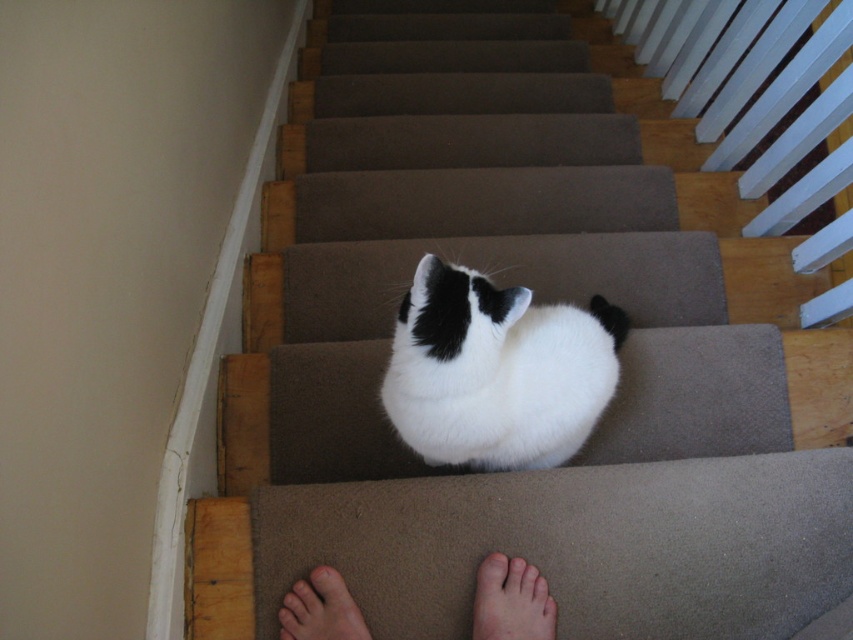
You are a person standing at the bottom of the stairs and want to pet the white fluffy cat at center. The pale skin at lower center belongs to your feet. Can you reach the cat without moving your feet?

The white fluffy cat at center is located above pale skin at lower center, so yes, you can reach the cat without moving your feet since it is positioned higher than your feet.

You are a photographer trying to capture a candid shot of the pale skin at lower center and light brown skin at lower center. Since you want to ensure both are in focus, which part of the two should you prioritize focusing on first based on their sizes?

The pale skin at lower center is larger in width than the light brown skin at lower center, so you should focus on the pale skin at lower center first as it requires more detailed focus due to its larger size.